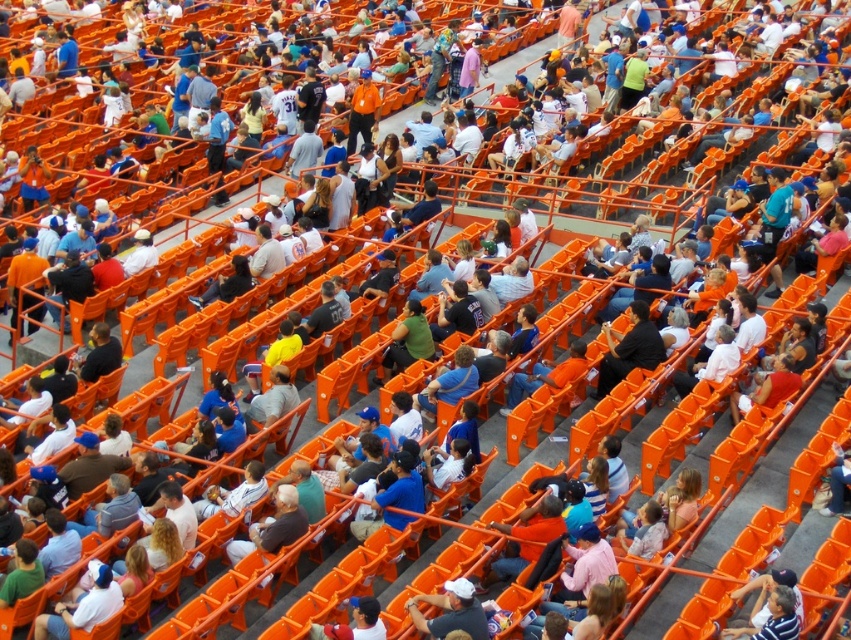
You are standing at the point marked as point (627, 356) in the stadium. If you want to take a photo of the entire crowd without moving, would your current position allow you to capture everyone in the frame?

The distance of point (627, 356) from the camera is 101.42 feet, so if your camera has a wide enough lens to capture the entire crowd from that distance, you can take the photo without moving. However, if the field of view is limited, you might need to adjust your position or use a wider lens.

You are standing at point (443,616) and want to move to the exit located at point (626,364). Is the exit directly in front of you or behind you?

The exit at point (626,364) is behind point (443,616), so it is behind you.

You are standing at the center of the stadium and notice a point marked at coordinates (629, 348). What is located at that exact point?

The black shirt at center is located at point (629, 348).